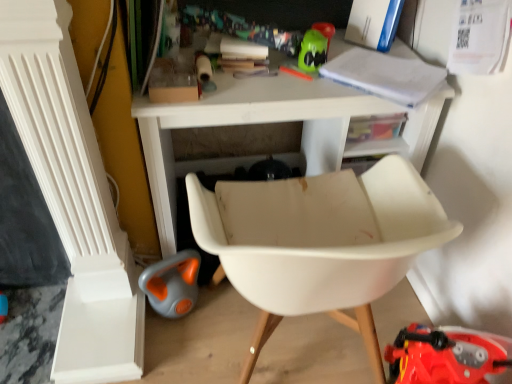
This screenshot has width=512, height=384. Find the location of `white matte table at upper center`. white matte table at upper center is located at coordinates (271, 125).

This screenshot has height=384, width=512. What do you see at coordinates (271, 125) in the screenshot?
I see `white matte table at upper center` at bounding box center [271, 125].

What is the approximate height of white plastic chair at center?

white plastic chair at center is 33.57 inches tall.

Locate an element on the screen. Image resolution: width=512 pixels, height=384 pixels. white plastic chair at center is located at coordinates (319, 242).

Describe the element at coordinates (319, 242) in the screenshot. I see `white plastic chair at center` at that location.

Where is `white matte table at upper center`? The width and height of the screenshot is (512, 384). white matte table at upper center is located at coordinates (x=271, y=125).

Which is more to the left, white plastic chair at center or white matte table at upper center?

white matte table at upper center is more to the left.

Who is more distant, white plastic chair at center or white matte table at upper center?

white matte table at upper center.

Does point (231, 185) appear closer or farther from the camera than point (175, 211)?

Point (231, 185) is positioned closer to the camera compared to point (175, 211).

From the image's perspective, who appears lower, white plastic chair at center or white matte table at upper center?

white plastic chair at center appears lower in the image.

From a real-world perspective, is white plastic chair at center below white matte table at upper center?

No, from a real-world perspective, white plastic chair at center is not beneath white matte table at upper center.

Is white plastic chair at center wider or thinner than white matte table at upper center?

Clearly, white plastic chair at center has more width compared to white matte table at upper center.

Which of these two, white plastic chair at center or white matte table at upper center, stands taller?

Standing taller between the two is white plastic chair at center.

Considering the sizes of objects white plastic chair at center and white matte table at upper center in the image provided, who is bigger, white plastic chair at center or white matte table at upper center?

white matte table at upper center.

Would you say white plastic chair at center is inside or outside white matte table at upper center?

white plastic chair at center is located beyond the bounds of white matte table at upper center.

Consider the image. Is white plastic chair at center directly adjacent to white matte table at upper center?

No, white plastic chair at center is not next to white matte table at upper center.

Is white plastic chair at center facing away from white matte table at upper center?

white plastic chair at center is not turned away from white matte table at upper center.

Can you tell me how much white plastic chair at center and white matte table at upper center differ in facing direction?

The facing directions of white plastic chair at center and white matte table at upper center are 180 degrees apart.

Find the location of a particular element. table that is under the white plastic chair at center (from a real-world perspective) is located at coordinates (271, 125).

Considering the positions of objects white matte table at upper center and white plastic chair at center in the image provided, who is more to the left, white matte table at upper center or white plastic chair at center?

white matte table at upper center.

Considering the positions of objects white matte table at upper center and white plastic chair at center in the image provided, who is behind, white matte table at upper center or white plastic chair at center?

Positioned behind is white matte table at upper center.

Between point (411, 117) and point (303, 225), which one is positioned behind?

Point (411, 117)

From the image's perspective, is white matte table at upper center positioned above or below white plastic chair at center?

white matte table at upper center is above white plastic chair at center.

From a real-world perspective, which is physically above, white matte table at upper center or white plastic chair at center?

From a 3D spatial view, white plastic chair at center is above.

Between white matte table at upper center and white plastic chair at center, which one has smaller width?

With smaller width is white matte table at upper center.

Between white matte table at upper center and white plastic chair at center, which one has less height?

Standing shorter between the two is white matte table at upper center.

Does white matte table at upper center have a larger size compared to white plastic chair at center?

Indeed, white matte table at upper center has a larger size compared to white plastic chair at center.

In the scene shown: Is white matte table at upper center situated inside white plastic chair at center or outside?

white matte table at upper center is not inside white plastic chair at center, it's outside.

Is white matte table at upper center touching white plastic chair at center?

white matte table at upper center and white plastic chair at center are not in contact.

Could you tell me if white matte table at upper center is facing white plastic chair at center?

Yes, white matte table at upper center is aimed at white plastic chair at center.

This screenshot has height=384, width=512. In order to click on chair in front of the white matte table at upper center in this screenshot , I will do `click(319, 242)`.

Identify the location of table that is behind the white plastic chair at center. The height and width of the screenshot is (384, 512). (271, 125).

Locate an element on the screen. table below the white plastic chair at center (from a real-world perspective) is located at coordinates (271, 125).